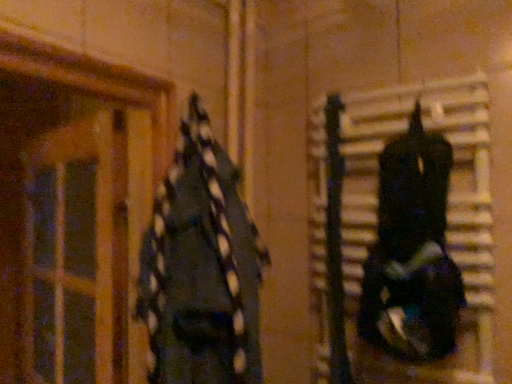
Question: Would you say translucent wooden door at left is to the left or to the right of shiny black helmet at right, the second clothing positioned from the left, in the picture?

Choices:
 (A) right
 (B) left

Answer: (B)

Question: From a real-world perspective, is translucent wooden door at left above or below shiny black helmet at right, marked as the 1th clothing in a right-to-left arrangement?

Choices:
 (A) above
 (B) below

Answer: (B)

Question: Considering the real-world distances, which object is closest to the shiny black helmet at right, marked as the 1th clothing in a right-to-left arrangement?

Choices:
 (A) translucent wooden door at left
 (B) dark blue fabric at left, marked as the 1th clothing in a left-to-right arrangement

Answer: (B)

Question: Considering the real-world distances, which object is farthest from the shiny black helmet at right, the second clothing positioned from the left?

Choices:
 (A) translucent wooden door at left
 (B) dark blue fabric at left, marked as the 1th clothing in a left-to-right arrangement

Answer: (A)